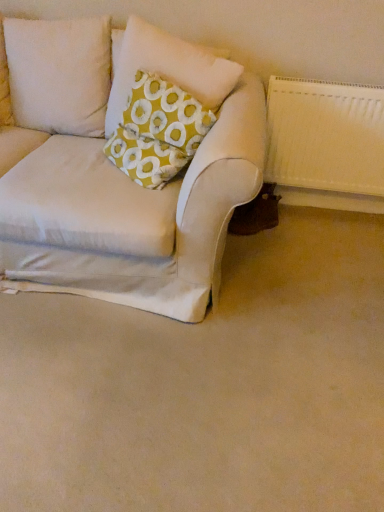
Question: Can you confirm if beige fabric couch at lower left is thinner than yellow fabric pillow at upper left?

Choices:
 (A) yes
 (B) no

Answer: (B)

Question: Considering the relative positions of beige fabric couch at lower left and yellow fabric pillow at upper left in the image provided, is beige fabric couch at lower left to the left of yellow fabric pillow at upper left from the viewer's perspective?

Choices:
 (A) yes
 (B) no

Answer: (A)

Question: From the image's perspective, is beige fabric couch at lower left under yellow fabric pillow at upper left?

Choices:
 (A) no
 (B) yes

Answer: (B)

Question: From a real-world perspective, is beige fabric couch at lower left over yellow fabric pillow at upper left?

Choices:
 (A) no
 (B) yes

Answer: (A)

Question: Is there a large distance between beige fabric couch at lower left and yellow fabric pillow at upper left?

Choices:
 (A) yes
 (B) no

Answer: (B)

Question: From the image's perspective, is yellow fabric pillow at upper left above or below beige fabric couch at lower left?

Choices:
 (A) below
 (B) above

Answer: (B)

Question: Is yellow fabric pillow at upper left inside the boundaries of beige fabric couch at lower left, or outside?

Choices:
 (A) outside
 (B) inside

Answer: (A)

Question: Considering their positions, is yellow fabric pillow at upper left located in front of or behind beige fabric couch at lower left?

Choices:
 (A) front
 (B) behind

Answer: (B)

Question: Is point (160, 58) closer or farther from the camera than point (148, 428)?

Choices:
 (A) farther
 (B) closer

Answer: (A)

Question: From the image's perspective, relative to yellow fabric pillow at upper left, is beige fabric couch at lower left above or below?

Choices:
 (A) below
 (B) above

Answer: (A)

Question: Would you say beige fabric couch at lower left is to the left or to the right of yellow fabric pillow at upper left in the picture?

Choices:
 (A) right
 (B) left

Answer: (B)

Question: Relative to yellow fabric pillow at upper left, is beige fabric couch at lower left in front or behind?

Choices:
 (A) behind
 (B) front

Answer: (B)

Question: Does point (170, 453) appear closer or farther from the camera than point (215, 66)?

Choices:
 (A) farther
 (B) closer

Answer: (B)

Question: In the image, is white textured radiator at right positioned in front of or behind yellow fabric pillow at upper left?

Choices:
 (A) behind
 (B) front

Answer: (A)

Question: Considering the positions of white textured radiator at right and yellow fabric pillow at upper left in the image, is white textured radiator at right wider or thinner than yellow fabric pillow at upper left?

Choices:
 (A) thin
 (B) wide

Answer: (A)